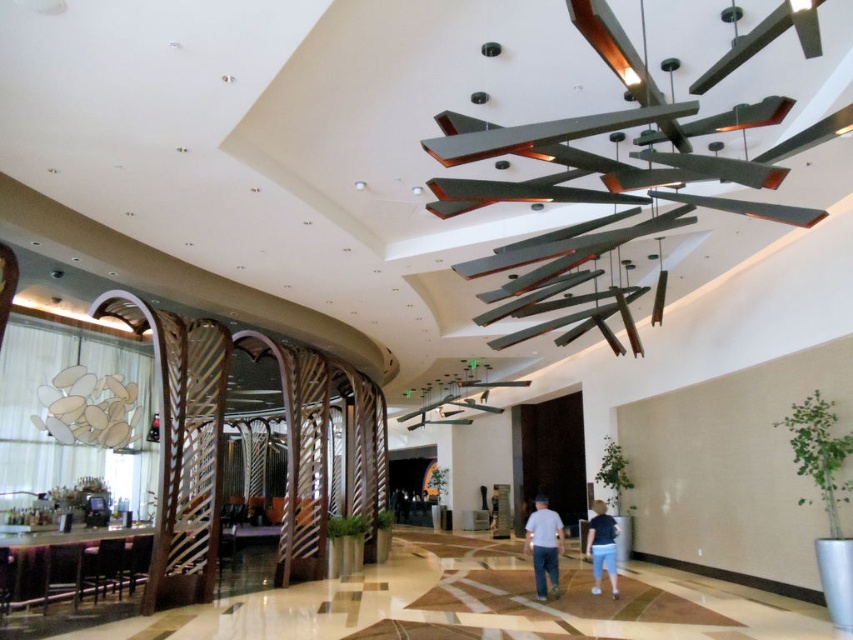
What are the coordinates of the light blue shirt at center?

The light blue shirt at center is located at coordinates point (x=544, y=545).

You are standing at the entrance of the building and want to walk towards the bar area. There are two points marked in the image, point 1 at coordinates point (550,540) and point 2 at coordinates point (598,554). Which point should you walk towards to reach the bar area more quickly?

Point 1 at coordinates point (550,540) is closer to the camera, so walking towards it would get you to the bar area more quickly.

You are a photographer positioned at the entrance of the upscale building. You need to capture a photo of both the light blue shirt at center and the blue denim shorts at center. Which object should you focus on first if you want to ensure both are in frame without moving the camera?

You should focus on the light blue shirt at center first because it is smaller than the blue denim shorts at center, so capturing it properly will help ensure both fit within the frame.